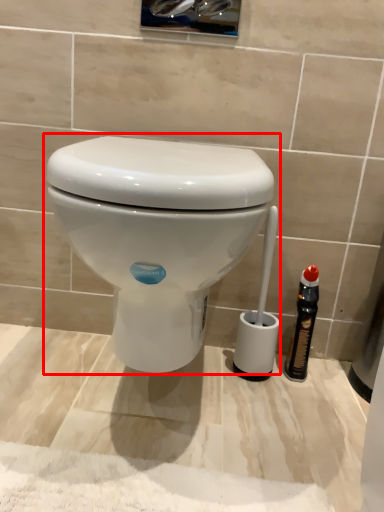
Question: From the image's perspective, what is the correct spatial relationship of toilet (annotated by the red box) in relation to bottle?

Choices:
 (A) above
 (B) below

Answer: (A)